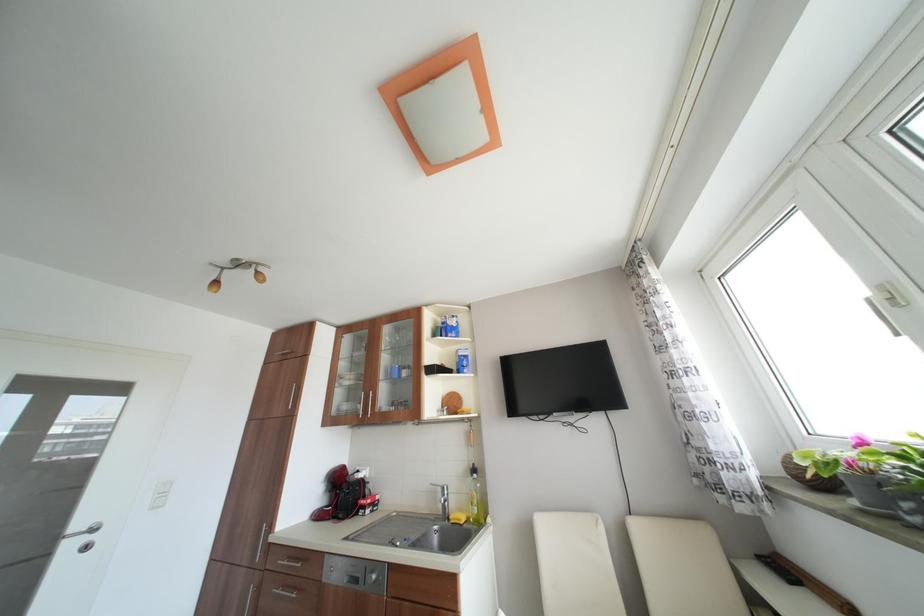
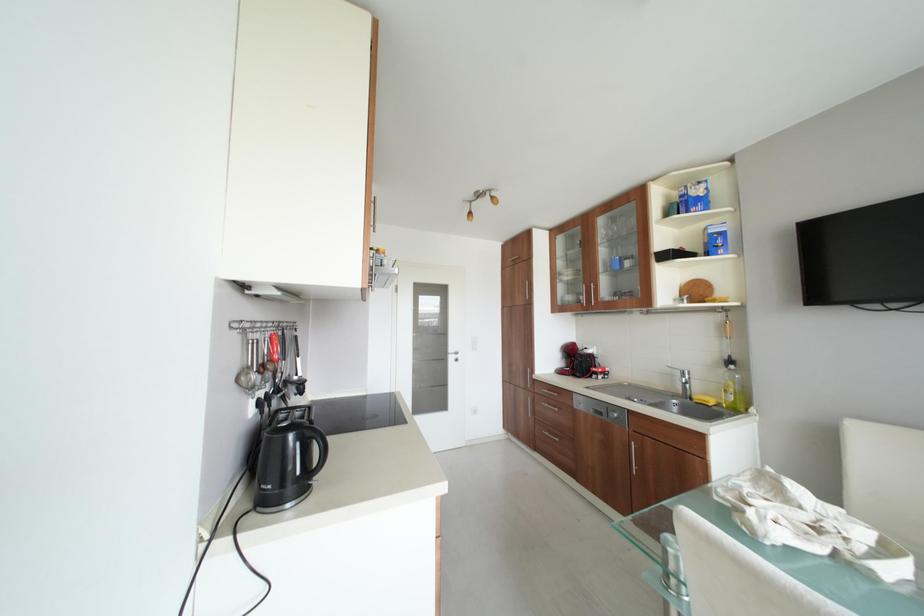
The first image is from the beginning of the video and the second image is from the end. How did the camera likely rotate when shooting the video?

The camera rotated toward left-down.